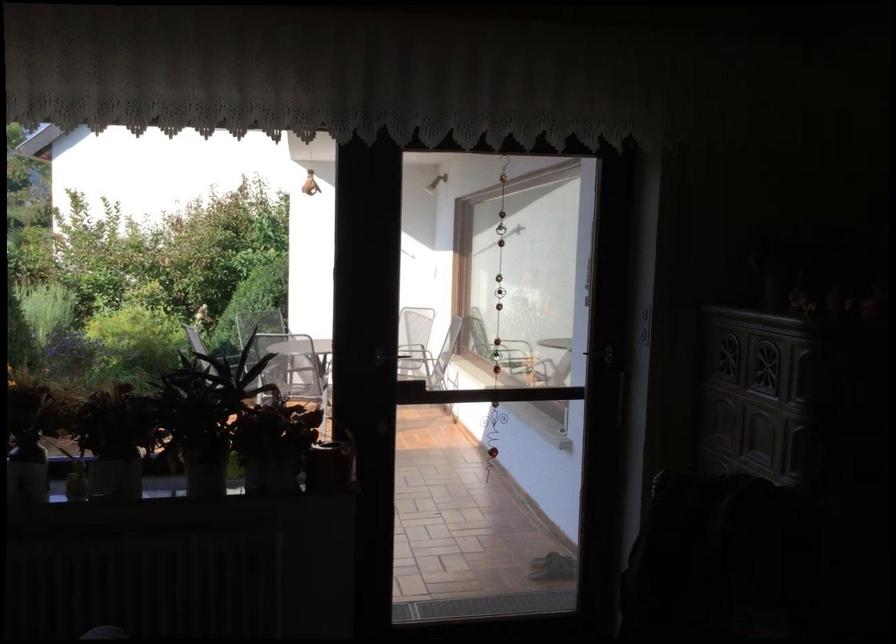
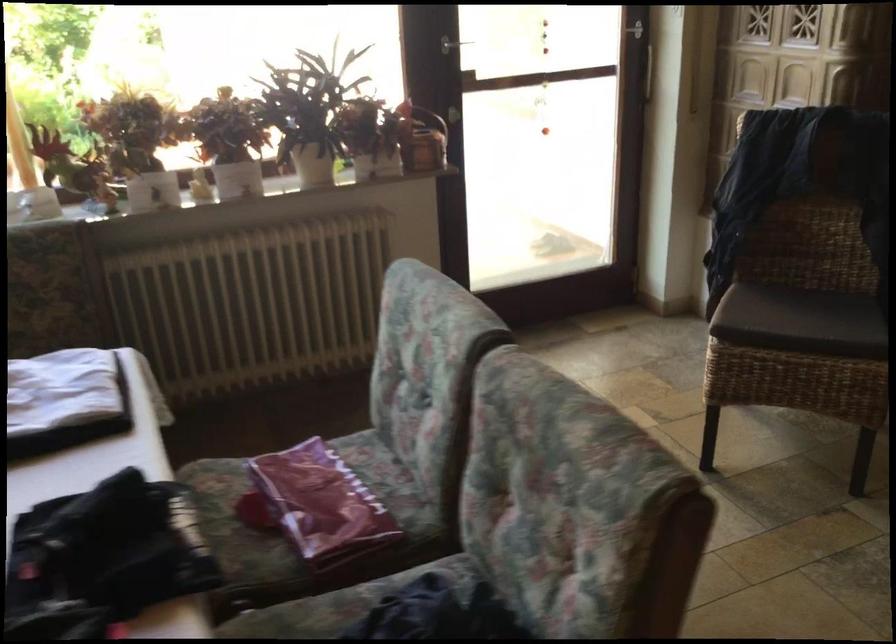
In a continuous first-person perspective shot, in which direction is the camera moving?

The movement direction of the cameraman is left, backward.